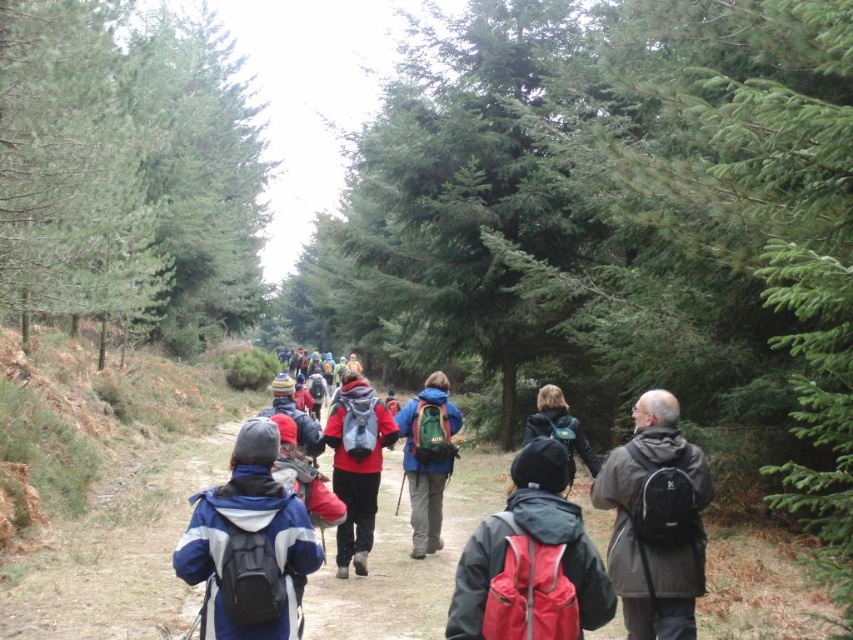
You are a hiker trying to navigate between two points in the forest. You see a point at coordinate [83,208] and another at [195,540]. Which point is closer to you?

Point [83,208] is closer to you because it is further to the viewer than point [195,540].

You are a hiker who wants to check the contents of both the red backpack at center and the matte black backpack at center. Which backpack should you approach first if you are standing to the right of both backpacks?

You should approach the red backpack at center first because it is to the left of the matte black backpack at center, so it is closer to your current position on the right side.

You are a hiker who wants to place a new backpack at the same 2D location as the red backpack at center. What are the coordinates you should aim for?

The coordinates for the red backpack at center are 0.877 in the x direction and 0.624 in the y direction.